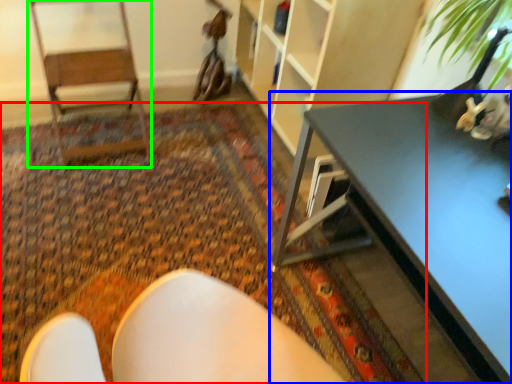
Question: Which object is positioned closest to mat (highlighted by a red box)? Select from table (highlighted by a blue box) and armchair (highlighted by a green box).

Choices:
 (A) table
 (B) armchair

Answer: (B)